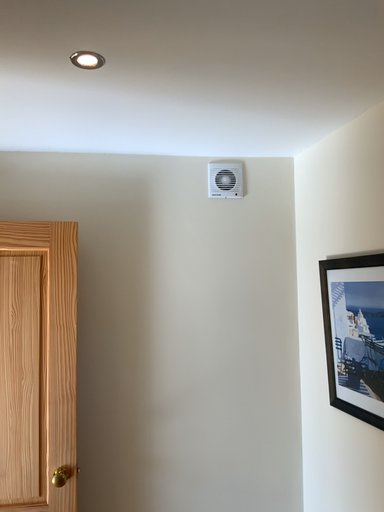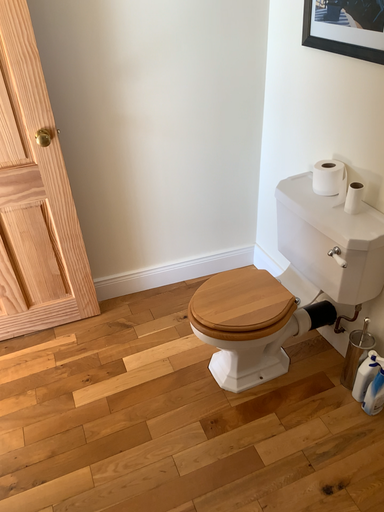
Question: How did the camera likely rotate when shooting the video?

Choices:
 (A) rotated downward
 (B) rotated upward

Answer: (A)